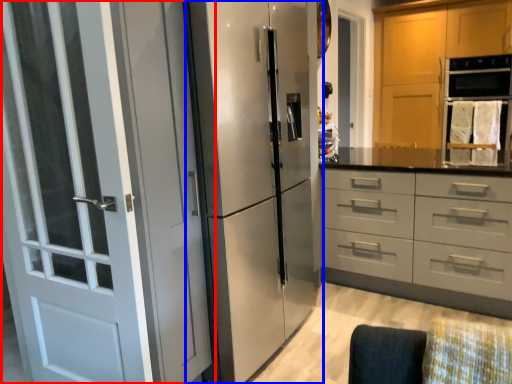
Question: Which of the following is the closest to the observer, door (highlighted by a red box) or refrigerator (highlighted by a blue box)?

Choices:
 (A) door
 (B) refrigerator

Answer: (A)